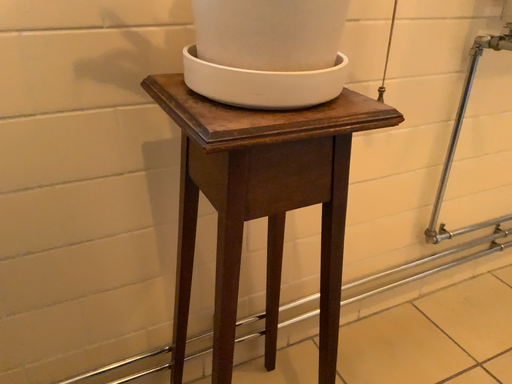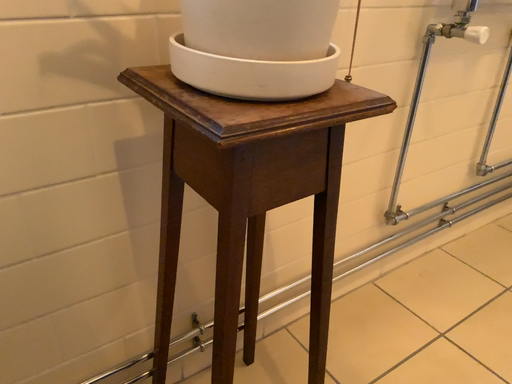
Question: How did the camera likely rotate when shooting the video?

Choices:
 (A) rotated left
 (B) rotated right

Answer: (B)